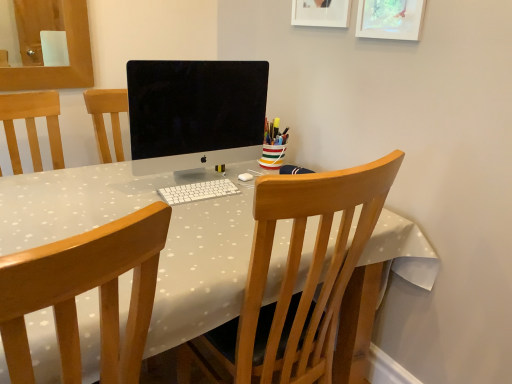
Where is `wooden chair at center, the 2th chair positioned from the left`? The image size is (512, 384). wooden chair at center, the 2th chair positioned from the left is located at coordinates (296, 274).

The height and width of the screenshot is (384, 512). What do you see at coordinates (273, 145) in the screenshot?
I see `striped ceramic cup at center` at bounding box center [273, 145].

What are the coordinates of `matte white picture frame at upper right, which is counted as the 1th picture frame, starting from the right` in the screenshot? It's located at pyautogui.click(x=390, y=19).

Describe the element at coordinates (198, 191) in the screenshot. This screenshot has width=512, height=384. I see `white plastic keyboard at center` at that location.

This screenshot has height=384, width=512. Describe the element at coordinates (321, 13) in the screenshot. I see `white matte picture frame at upper center, the second picture frame positioned from the right` at that location.

At what (x,y) coordinates should I click in order to perform the action: click on wooden chair at center, the first chair viewed from the right. Please return your answer as a coordinate pair (x, y). Image resolution: width=512 pixels, height=384 pixels. Looking at the image, I should click on (296, 274).

Considering the relative positions of white matte picture frame at upper center, the second picture frame positioned from the right, and white plastic keyboard at center in the image provided, is white matte picture frame at upper center, the second picture frame positioned from the right, in front of white plastic keyboard at center?

No, white matte picture frame at upper center, the second picture frame positioned from the right, is behind white plastic keyboard at center.

Which point is more distant from viewer, (297, 16) or (213, 183)?

Positioned behind is point (297, 16).

At what (x,y) coordinates should I click in order to perform the action: click on computer keyboard in front of the white matte picture frame at upper center, the second picture frame positioned from the right. Please return your answer as a coordinate pair (x, y). This screenshot has width=512, height=384. Looking at the image, I should click on (198, 191).

Can you tell me how much white matte picture frame at upper center, the second picture frame positioned from the right, and white plastic keyboard at center differ in facing direction?

They differ by 90 degrees in their facing directions.

Is wooden chair at center, the second chair when ordered from right to left, situated inside white matte picture frame at upper center, arranged as the 1th picture frame when viewed from the left, or outside?

wooden chair at center, the second chair when ordered from right to left, lies outside white matte picture frame at upper center, arranged as the 1th picture frame when viewed from the left.

Does point (13, 362) appear closer or farther from the camera than point (344, 14)?

Point (13, 362) is positioned closer to the camera compared to point (344, 14).

Based on the photo, from the image's perspective, would you say wooden chair at center, positioned as the 1th chair in left-to-right order, is shown under white matte picture frame at upper center, the second picture frame positioned from the right?

Indeed, from the image's perspective, wooden chair at center, positioned as the 1th chair in left-to-right order, is shown beneath white matte picture frame at upper center, the second picture frame positioned from the right.

From a real-world perspective, which object stands above the other?

white matte picture frame at upper center, the second picture frame positioned from the right.

The image size is (512, 384). I want to click on picture frame that is behind the white plastic keyboard at center, so click(321, 13).

Could you measure the distance between white plastic keyboard at center and white matte picture frame at upper center, the second picture frame positioned from the right?

white plastic keyboard at center and white matte picture frame at upper center, the second picture frame positioned from the right, are 30.67 inches apart.

Can you tell me how much white plastic keyboard at center and white matte picture frame at upper center, the second picture frame positioned from the right, differ in facing direction?

The facing directions of white plastic keyboard at center and white matte picture frame at upper center, the second picture frame positioned from the right, are 90 degrees apart.

From the image's perspective, would you say white plastic keyboard at center is shown under white matte picture frame at upper center, the second picture frame positioned from the right?

Yes, from the image's perspective, white plastic keyboard at center is below white matte picture frame at upper center, the second picture frame positioned from the right.

From a real-world perspective, between striped ceramic cup at center and matte white picture frame at upper right, which is counted as the 1th picture frame, starting from the right, who is vertically lower?

striped ceramic cup at center.

Which object is wider, striped ceramic cup at center or matte white picture frame at upper right, the 2th picture frame positioned from the left?

striped ceramic cup at center is wider.

From the image's perspective, is striped ceramic cup at center located beneath matte white picture frame at upper right, which is counted as the 1th picture frame, starting from the right?

Correct, striped ceramic cup at center appears lower than matte white picture frame at upper right, which is counted as the 1th picture frame, starting from the right, in the image.

How far apart are striped ceramic cup at center and matte white picture frame at upper right, which is counted as the 1th picture frame, starting from the right?

A distance of 24.08 inches exists between striped ceramic cup at center and matte white picture frame at upper right, which is counted as the 1th picture frame, starting from the right.

Measure the distance from wooden chair at center, positioned as the 1th chair in left-to-right order, to white plastic keyboard at center.

wooden chair at center, positioned as the 1th chair in left-to-right order, is 68.11 centimeters from white plastic keyboard at center.

From a real-world perspective, is wooden chair at center, the second chair when ordered from right to left, below white plastic keyboard at center?

Yes, from a real-world perspective, wooden chair at center, the second chair when ordered from right to left, is under white plastic keyboard at center.

Is wooden chair at center, the second chair when ordered from right to left, directly adjacent to white plastic keyboard at center?

No, wooden chair at center, the second chair when ordered from right to left, is not in contact with white plastic keyboard at center.

From the image's perspective, relative to wooden chair at center, the first chair viewed from the right, is matte white picture frame at upper right, which is counted as the 1th picture frame, starting from the right, above or below?

Clearly, from the image's perspective, matte white picture frame at upper right, which is counted as the 1th picture frame, starting from the right, is above wooden chair at center, the first chair viewed from the right.

Does matte white picture frame at upper right, which is counted as the 1th picture frame, starting from the right, appear on the left side of wooden chair at center, the 2th chair positioned from the left?

In fact, matte white picture frame at upper right, which is counted as the 1th picture frame, starting from the right, is to the right of wooden chair at center, the 2th chair positioned from the left.

Is point (389, 24) more distant than point (258, 339)?

Yes, it is.

Which chair is the 1st one when counting from the left side of the matte white picture frame at upper right, which is counted as the 1th picture frame, starting from the right? Please provide its 2D coordinates.

[(296, 274)]

Locate an element on the screen. The image size is (512, 384). computer monitor that appears above the wooden chair at center, the 2th chair positioned from the left (from the image's perspective) is located at coordinates (195, 113).

Is sleek silver monitor at center to the left of wooden chair at center, the 2th chair positioned from the left, from the viewer's perspective?

Indeed, sleek silver monitor at center is positioned on the left side of wooden chair at center, the 2th chair positioned from the left.

Is sleek silver monitor at center in front of or behind wooden chair at center, the first chair viewed from the right, in the image?

In the image, sleek silver monitor at center appears behind wooden chair at center, the first chair viewed from the right.

The width and height of the screenshot is (512, 384). In the image, there is a white matte picture frame at upper center, the second picture frame positioned from the right. Find the location of `computer keyboard below it (from a real-world perspective)`. computer keyboard below it (from a real-world perspective) is located at coordinates (198, 191).

Locate an element on the screen. the 2nd chair in front when counting from the white matte picture frame at upper center, arranged as the 1th picture frame when viewed from the left is located at coordinates (85, 291).

In the scene shown: When comparing their distances from sleek silver monitor at center, does matte white picture frame at upper right, the 2th picture frame positioned from the left, or white plastic keyboard at center seem further?

Among the two, matte white picture frame at upper right, the 2th picture frame positioned from the left, is located further to sleek silver monitor at center.

Estimate the real-world distances between objects in this image. Which object is closer to white plastic keyboard at center, matte white picture frame at upper right, which is counted as the 1th picture frame, starting from the right, or wooden chair at center, positioned as the 1th chair in left-to-right order?

The object closer to white plastic keyboard at center is wooden chair at center, positioned as the 1th chair in left-to-right order.

Considering their positions, is white matte picture frame at upper center, arranged as the 1th picture frame when viewed from the left, positioned further to white plastic keyboard at center than matte white picture frame at upper right, the 2th picture frame positioned from the left?

white matte picture frame at upper center, arranged as the 1th picture frame when viewed from the left, is further to white plastic keyboard at center.

From the image, which object appears to be nearer to striped ceramic cup at center, matte white picture frame at upper right, the 2th picture frame positioned from the left, or white plastic keyboard at center?

Among the two, white plastic keyboard at center is located nearer to striped ceramic cup at center.

Which object lies further to the anchor point striped ceramic cup at center, white matte picture frame at upper center, the second picture frame positioned from the right, or white plastic keyboard at center?

The object further to striped ceramic cup at center is white matte picture frame at upper center, the second picture frame positioned from the right.

Looking at the image, which one is located closer to matte white picture frame at upper right, which is counted as the 1th picture frame, starting from the right, striped ceramic cup at center or white plastic keyboard at center?

Based on the image, striped ceramic cup at center appears to be nearer to matte white picture frame at upper right, which is counted as the 1th picture frame, starting from the right.

Based on their spatial positions, is wooden chair at center, the 2th chair positioned from the left, or striped ceramic cup at center further from wooden chair at center, positioned as the 1th chair in left-to-right order?

Among the two, striped ceramic cup at center is located further to wooden chair at center, positioned as the 1th chair in left-to-right order.

Looking at the image, which one is located further to wooden chair at center, the second chair when ordered from right to left, white matte picture frame at upper center, arranged as the 1th picture frame when viewed from the left, or matte white picture frame at upper right, the 2th picture frame positioned from the left?

white matte picture frame at upper center, arranged as the 1th picture frame when viewed from the left.

Identify the location of computer monitor that lies between matte white picture frame at upper right, the 2th picture frame positioned from the left, and wooden chair at center, the 2th chair positioned from the left, from top to bottom. This screenshot has width=512, height=384. (195, 113).

Locate an element on the screen. computer monitor positioned between wooden chair at center, positioned as the 1th chair in left-to-right order, and striped ceramic cup at center from near to far is located at coordinates (195, 113).

At what (x,y) coordinates should I click in order to perform the action: click on computer monitor positioned between wooden chair at center, the second chair when ordered from right to left, and white plastic keyboard at center from near to far. Please return your answer as a coordinate pair (x, y). This screenshot has width=512, height=384. Looking at the image, I should click on (195, 113).

Where is `chair positioned between wooden chair at center, the second chair when ordered from right to left, and white plastic keyboard at center from near to far`? The image size is (512, 384). chair positioned between wooden chair at center, the second chair when ordered from right to left, and white plastic keyboard at center from near to far is located at coordinates (296, 274).